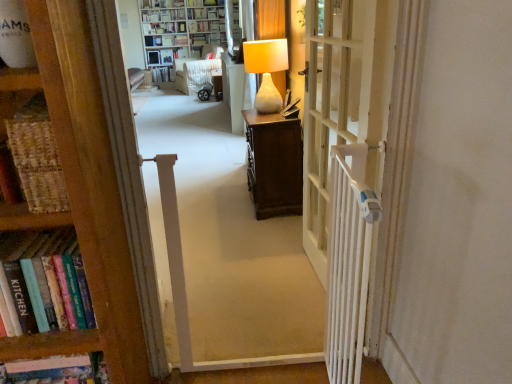
Question: From the image's perspective, is matte white lamp at center located beneath velvet beige armchair at center, which is the second furniture from right to left?

Choices:
 (A) yes
 (B) no

Answer: (A)

Question: From a real-world perspective, is matte white lamp at center on velvet beige armchair at center, which is the second furniture in front-to-back order?

Choices:
 (A) yes
 (B) no

Answer: (A)

Question: Can you confirm if matte white lamp at center is shorter than velvet beige armchair at center, the 1th furniture viewed from the left?

Choices:
 (A) yes
 (B) no

Answer: (A)

Question: From a real-world perspective, is matte white lamp at center physically below velvet beige armchair at center, which is the second furniture from right to left?

Choices:
 (A) no
 (B) yes

Answer: (A)

Question: Does matte white lamp at center have a greater height compared to velvet beige armchair at center, placed as the 1th furniture when sorted from back to front?

Choices:
 (A) no
 (B) yes

Answer: (A)

Question: Is matte white lamp at center next to velvet beige armchair at center, placed as the 1th furniture when sorted from back to front?

Choices:
 (A) yes
 (B) no

Answer: (B)

Question: Does white wooden door at center appear on the left side of white glossy bookcase at upper center, the 2th bookcase positioned from the front?

Choices:
 (A) yes
 (B) no

Answer: (B)

Question: Is white wooden door at center facing away from white glossy bookcase at upper center, which is the first bookcase from top to bottom?

Choices:
 (A) no
 (B) yes

Answer: (A)

Question: Is white wooden door at center positioned far away from white glossy bookcase at upper center, which is the first bookcase from top to bottom?

Choices:
 (A) no
 (B) yes

Answer: (B)

Question: Is white wooden door at center closer to camera compared to white glossy bookcase at upper center, the 2th bookcase positioned from the front?

Choices:
 (A) yes
 (B) no

Answer: (A)

Question: Is white glossy bookcase at upper center, the 2th bookcase positioned from the front, located within white wooden door at center?

Choices:
 (A) no
 (B) yes

Answer: (A)

Question: Can you see white wooden door at center touching white glossy bookcase at upper center, the second bookcase positioned from the bottom?

Choices:
 (A) yes
 (B) no

Answer: (B)

Question: Can you confirm if matte white lamp at center is bigger than hardcover book at upper center, the 1th book viewed from the top?

Choices:
 (A) yes
 (B) no

Answer: (A)